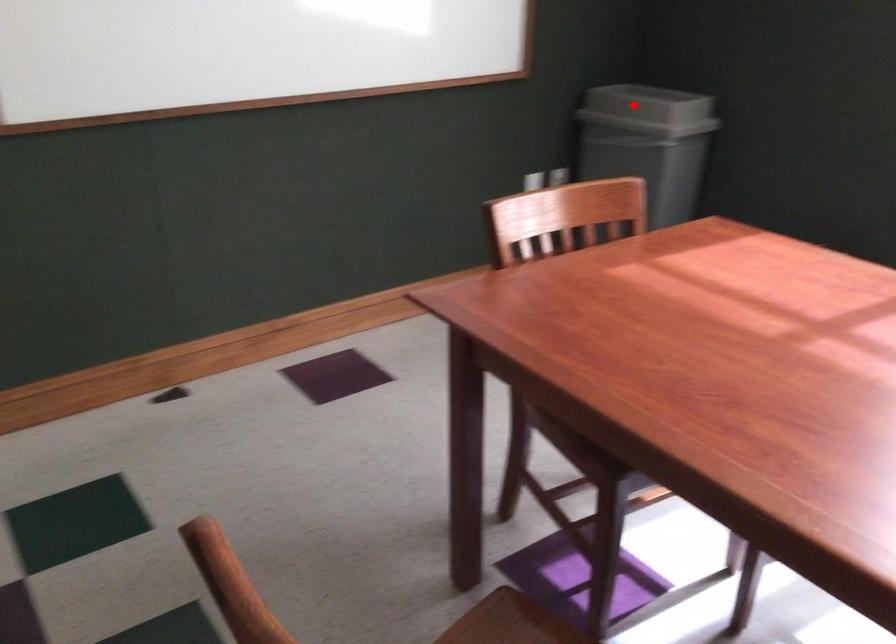
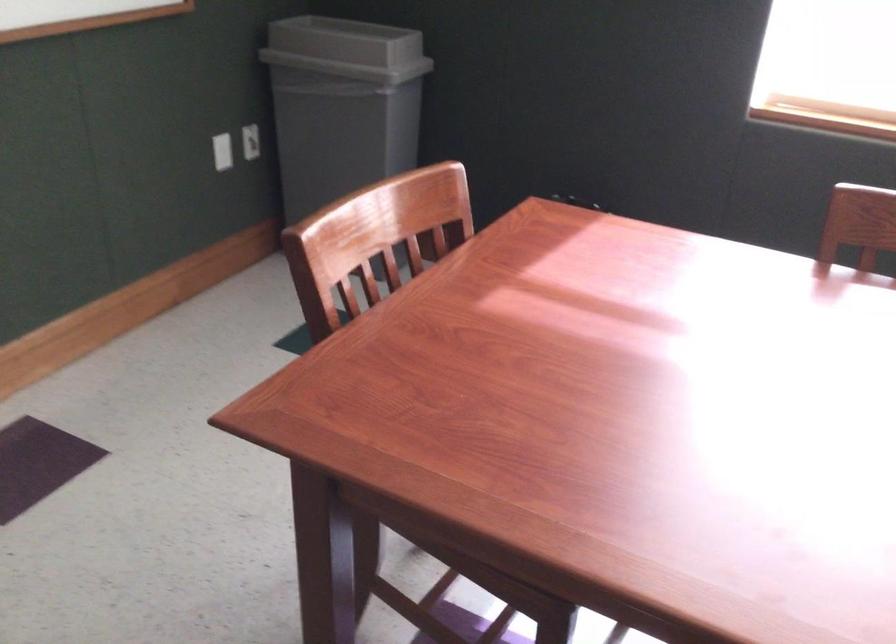
Locate, in the second image, the point that corresponds to the highlighted location in the first image.

(346, 49)